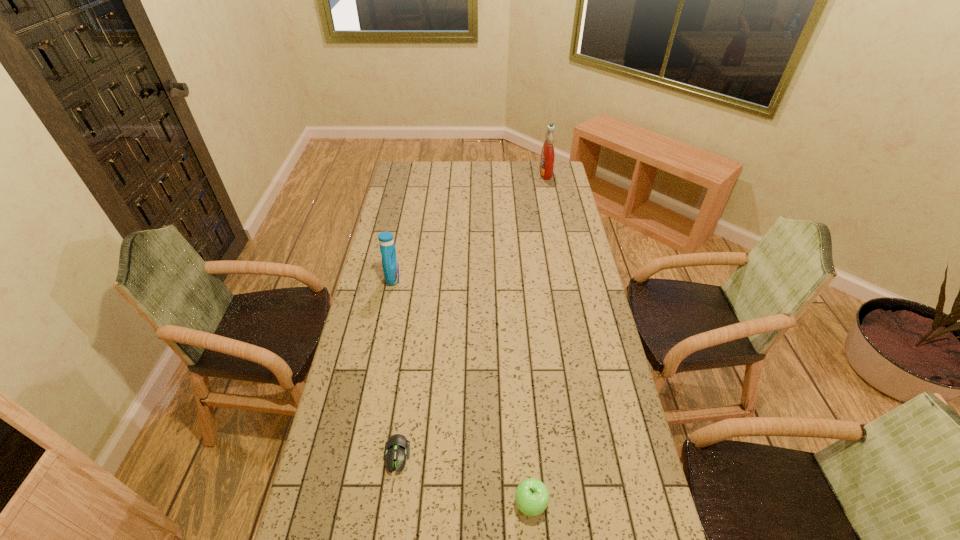
Identify the location of the right detergent. (547, 155).

The height and width of the screenshot is (540, 960). I want to click on the farther detergent, so click(x=547, y=155).

Find the location of a particular element. This screenshot has width=960, height=540. the second tallest object is located at coordinates tap(390, 264).

Find the location of a particular element. The image size is (960, 540). the leftmost object is located at coordinates (390, 264).

I want to click on apple, so click(532, 497).

Find the location of `the third tallest object`. the third tallest object is located at coordinates (532, 497).

I want to click on the second nearest object, so click(397, 447).

Locate an element on the screen. Image resolution: width=960 pixels, height=540 pixels. computer mouse is located at coordinates (397, 447).

Where is `free location located 0.050m on the front surface of the taller detergent`? free location located 0.050m on the front surface of the taller detergent is located at coordinates (530, 173).

This screenshot has height=540, width=960. I want to click on vacant space located on the front surface of the taller detergent, so click(508, 173).